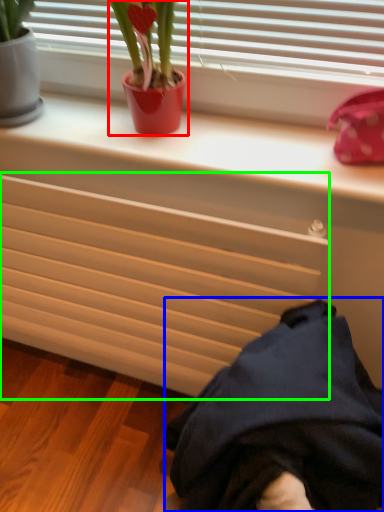
Question: Which object is positioned closest to houseplant (highlighted by a red box)? Select from clothing (highlighted by a blue box) and radiator (highlighted by a green box).

Choices:
 (A) clothing
 (B) radiator

Answer: (B)